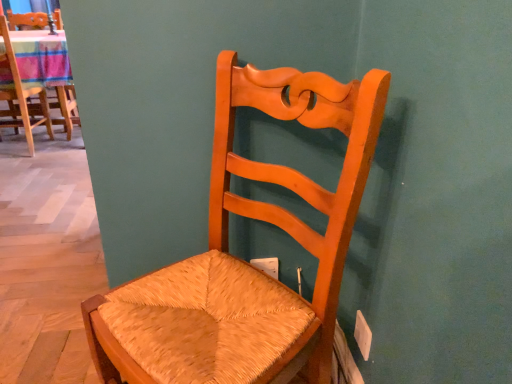
At what (x,y) coordinates should I click in order to perform the action: click on matte wood chair at center, positioned as the 2th chair in back-to-front order. Please return your answer as a coordinate pair (x, y). This screenshot has height=384, width=512. Looking at the image, I should click on (242, 260).

What is the approximate height of matte wood chair at center, positioned as the 2th chair in back-to-front order?

It is 37.26 inches.

The image size is (512, 384). Describe the element at coordinates (242, 260) in the screenshot. I see `matte wood chair at center, which appears as the 2th chair when viewed from the top` at that location.

This screenshot has height=384, width=512. What do you see at coordinates (21, 95) in the screenshot?
I see `woven straw chair at upper left, positioned as the first chair in left-to-right order` at bounding box center [21, 95].

Identify the location of woven straw chair at upper left, which is the first chair in back-to-front order. The image size is (512, 384). (21, 95).

This screenshot has width=512, height=384. I want to click on matte wood chair at center, the 1th chair positioned from the right, so click(x=242, y=260).

Considering the positions of objects matte wood chair at center, the 2th chair when ordered from left to right, and woven straw chair at upper left, placed as the second chair when sorted from right to left, in the image provided, who is more to the right, matte wood chair at center, the 2th chair when ordered from left to right, or woven straw chair at upper left, placed as the second chair when sorted from right to left,?

Positioned to the right is matte wood chair at center, the 2th chair when ordered from left to right.

From the picture: Which object is further away from the camera taking this photo, matte wood chair at center, the first chair in the bottom-to-top sequence, or woven straw chair at upper left, which is the first chair in back-to-front order?

woven straw chair at upper left, which is the first chair in back-to-front order, is further from the camera.

Is point (310, 327) more distant than point (19, 114)?

No, (310, 327) is in front of (19, 114).

From the image's perspective, is matte wood chair at center, positioned as the 2th chair in back-to-front order, located beneath woven straw chair at upper left, the second chair when ordered from bottom to top?

Correct, matte wood chair at center, positioned as the 2th chair in back-to-front order, appears lower than woven straw chair at upper left, the second chair when ordered from bottom to top, in the image.

From a real-world perspective, is matte wood chair at center, positioned as the 2th chair in back-to-front order, over woven straw chair at upper left, which is counted as the second chair, starting from the front?

No, from a real-world perspective, matte wood chair at center, positioned as the 2th chair in back-to-front order, is not on top of woven straw chair at upper left, which is counted as the second chair, starting from the front.

Is matte wood chair at center, which appears as the 2th chair when viewed from the top, wider than woven straw chair at upper left, positioned as the first chair in left-to-right order?

Indeed, matte wood chair at center, which appears as the 2th chair when viewed from the top, has a greater width compared to woven straw chair at upper left, positioned as the first chair in left-to-right order.

Which of these two, matte wood chair at center, which is the first chair from front to back, or woven straw chair at upper left, which is the first chair in back-to-front order, stands shorter?

Standing shorter between the two is woven straw chair at upper left, which is the first chair in back-to-front order.

Is matte wood chair at center, positioned as the 2th chair in back-to-front order, bigger or smaller than woven straw chair at upper left, which is the first chair from top to bottom?

Considering their sizes, matte wood chair at center, positioned as the 2th chair in back-to-front order, takes up more space than woven straw chair at upper left, which is the first chair from top to bottom.

Is woven straw chair at upper left, which is the first chair from top to bottom, surrounded by matte wood chair at center, the first chair in the bottom-to-top sequence?

No.

Is matte wood chair at center, which appears as the 2th chair when viewed from the top, next to woven straw chair at upper left, which is the first chair from top to bottom?

They are not placed beside each other.

Could you tell me if matte wood chair at center, the first chair in the bottom-to-top sequence, is facing woven straw chair at upper left, which is counted as the second chair, starting from the front?

No.

How many degrees apart are the facing directions of matte wood chair at center, the 1th chair positioned from the right, and woven straw chair at upper left, which is the first chair from top to bottom?

There is a 127-degree angle between the facing directions of matte wood chair at center, the 1th chair positioned from the right, and woven straw chair at upper left, which is the first chair from top to bottom.

You are a GUI agent. You are given a task and a screenshot of the screen. Output one action in this format:
    pyautogui.click(x=<x>, y=<y>)
    Task: Click on the chair in front of the woven straw chair at upper left, positioned as the first chair in left-to-right order
    Image resolution: width=512 pixels, height=384 pixels.
    Given the screenshot: What is the action you would take?
    pyautogui.click(x=242, y=260)

Considering the positions of objects woven straw chair at upper left, the second chair when ordered from bottom to top, and matte wood chair at center, which is the first chair from front to back, in the image provided, who is more to the right, woven straw chair at upper left, the second chair when ordered from bottom to top, or matte wood chair at center, which is the first chair from front to back,?

From the viewer's perspective, matte wood chair at center, which is the first chair from front to back, appears more on the right side.

Considering the relative positions of woven straw chair at upper left, which is the first chair from top to bottom, and matte wood chair at center, the 2th chair when ordered from left to right, in the image provided, is woven straw chair at upper left, which is the first chair from top to bottom, behind matte wood chair at center, the 2th chair when ordered from left to right,?

Yes, it is behind matte wood chair at center, the 2th chair when ordered from left to right.

Which point is more forward, (2,31) or (257,101)?

The point (257,101) is closer to the camera.

From the image's perspective, is woven straw chair at upper left, which is counted as the second chair, starting from the front, above matte wood chair at center, the 1th chair positioned from the right?

Yes, from the image's perspective, woven straw chair at upper left, which is counted as the second chair, starting from the front, is above matte wood chair at center, the 1th chair positioned from the right.

From a real-world perspective, is woven straw chair at upper left, which is counted as the second chair, starting from the front, positioned over matte wood chair at center, positioned as the 2th chair in back-to-front order, based on gravity?

Indeed, from a real-world perspective, woven straw chair at upper left, which is counted as the second chair, starting from the front, stands above matte wood chair at center, positioned as the 2th chair in back-to-front order.

Looking at their sizes, would you say woven straw chair at upper left, positioned as the first chair in left-to-right order, is wider or thinner than matte wood chair at center, the 2th chair when ordered from left to right?

woven straw chair at upper left, positioned as the first chair in left-to-right order, is thinner than matte wood chair at center, the 2th chair when ordered from left to right.

In terms of height, does woven straw chair at upper left, which is counted as the second chair, starting from the front, look taller or shorter compared to matte wood chair at center, which appears as the 2th chair when viewed from the top?

Considering their sizes, woven straw chair at upper left, which is counted as the second chair, starting from the front, has less height than matte wood chair at center, which appears as the 2th chair when viewed from the top.

Is woven straw chair at upper left, the second chair when ordered from bottom to top, bigger than matte wood chair at center, the first chair in the bottom-to-top sequence?

No, woven straw chair at upper left, the second chair when ordered from bottom to top, is not bigger than matte wood chair at center, the first chair in the bottom-to-top sequence.

Based on the photo, would you say woven straw chair at upper left, placed as the second chair when sorted from right to left, is inside or outside matte wood chair at center, the 1th chair positioned from the right?

woven straw chair at upper left, placed as the second chair when sorted from right to left, is spatially situated outside matte wood chair at center, the 1th chair positioned from the right.

Are woven straw chair at upper left, which is the first chair from top to bottom, and matte wood chair at center, the 2th chair when ordered from left to right, making contact?

woven straw chair at upper left, which is the first chair from top to bottom, is not next to matte wood chair at center, the 2th chair when ordered from left to right, and they're not touching.

In the scene shown: Could you tell me if woven straw chair at upper left, which is the first chair in back-to-front order, is turned towards matte wood chair at center, which appears as the 2th chair when viewed from the top?

No, woven straw chair at upper left, which is the first chair in back-to-front order, is not oriented towards matte wood chair at center, which appears as the 2th chair when viewed from the top.

What's the angular difference between woven straw chair at upper left, which is the first chair from top to bottom, and matte wood chair at center, the first chair in the bottom-to-top sequence,'s facing directions?

woven straw chair at upper left, which is the first chair from top to bottom, and matte wood chair at center, the first chair in the bottom-to-top sequence, are facing 127 degrees away from each other.

Based on the photo, measure the distance between woven straw chair at upper left, which is counted as the second chair, starting from the front, and matte wood chair at center, the 1th chair positioned from the right.

The distance of woven straw chair at upper left, which is counted as the second chair, starting from the front, from matte wood chair at center, the 1th chair positioned from the right, is 8.68 feet.

You are a GUI agent. You are given a task and a screenshot of the screen. Output one action in this format:
    pyautogui.click(x=<x>, y=<y>)
    Task: Click on the chair below the woven straw chair at upper left, positioned as the first chair in left-to-right order (from the image's perspective)
    The image size is (512, 384).
    Given the screenshot: What is the action you would take?
    pyautogui.click(x=242, y=260)

Identify the location of chair lying on the right of woven straw chair at upper left, which is the first chair from top to bottom. Image resolution: width=512 pixels, height=384 pixels. (242, 260).

Locate an element on the screen. chair that is above the matte wood chair at center, which is the first chair from front to back (from a real-world perspective) is located at coordinates (21, 95).